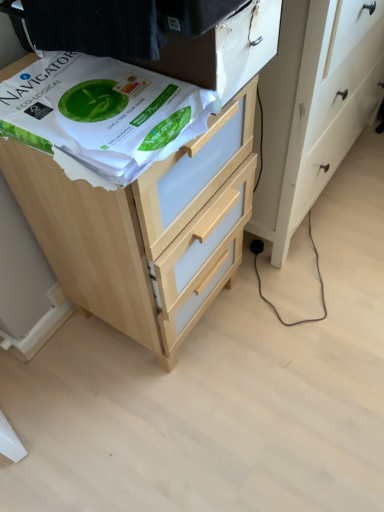
Question: From a real-world perspective, is white paper at upper left above or below light wood chest of drawers at upper center?

Choices:
 (A) below
 (B) above

Answer: (B)

Question: From the image's perspective, is white paper at upper left positioned above or below light wood chest of drawers at upper center?

Choices:
 (A) below
 (B) above

Answer: (B)

Question: From their relative heights in the image, would you say white paper at upper left is taller or shorter than light wood chest of drawers at upper center?

Choices:
 (A) short
 (B) tall

Answer: (A)

Question: From the image's perspective, is light wood chest of drawers at upper center above or below white paper at upper left?

Choices:
 (A) below
 (B) above

Answer: (A)

Question: Looking at their shapes, would you say light wood chest of drawers at upper center is wider or thinner than white paper at upper left?

Choices:
 (A) thin
 (B) wide

Answer: (B)

Question: Does point (165, 335) appear closer or farther from the camera than point (29, 118)?

Choices:
 (A) farther
 (B) closer

Answer: (A)

Question: In the image, is light wood chest of drawers at upper center on the left side or the right side of white paper at upper left?

Choices:
 (A) left
 (B) right

Answer: (B)